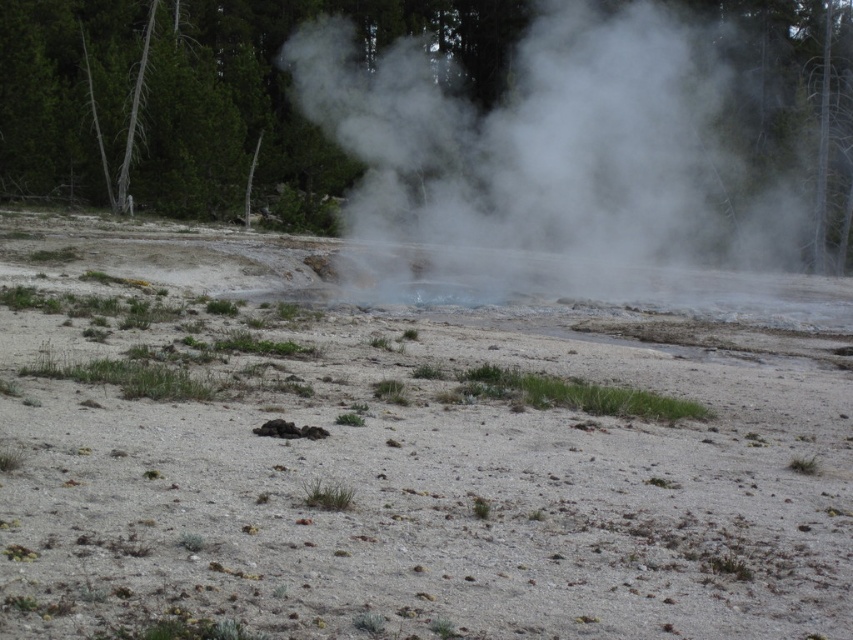
You are a park ranger checking the geothermal area. You notice the gray sandy dirt field at center and the white vapor steam at center. Which object is located below the other?

The gray sandy dirt field at center is positioned under white vapor steam at center.

You are standing in the geothermal area and want to place a safety barrier between the two points, point (407, 509) and point (405, 292). Which point should the barrier be closer to in order to protect visitors from the steam vent?

The barrier should be closer to point (407, 509) because it is closer to the viewer than point (405, 292), ensuring visitors are kept at a safe distance from the steam vent.